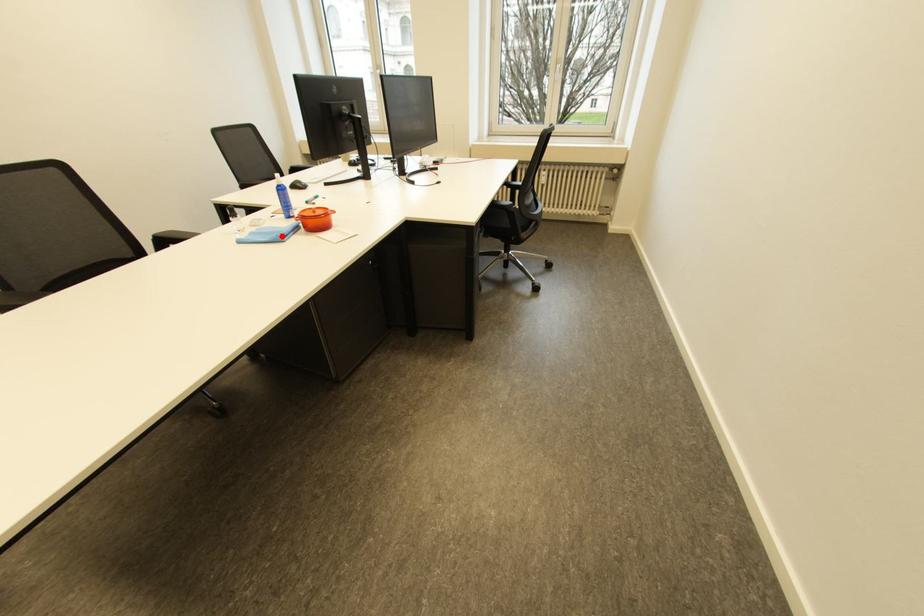
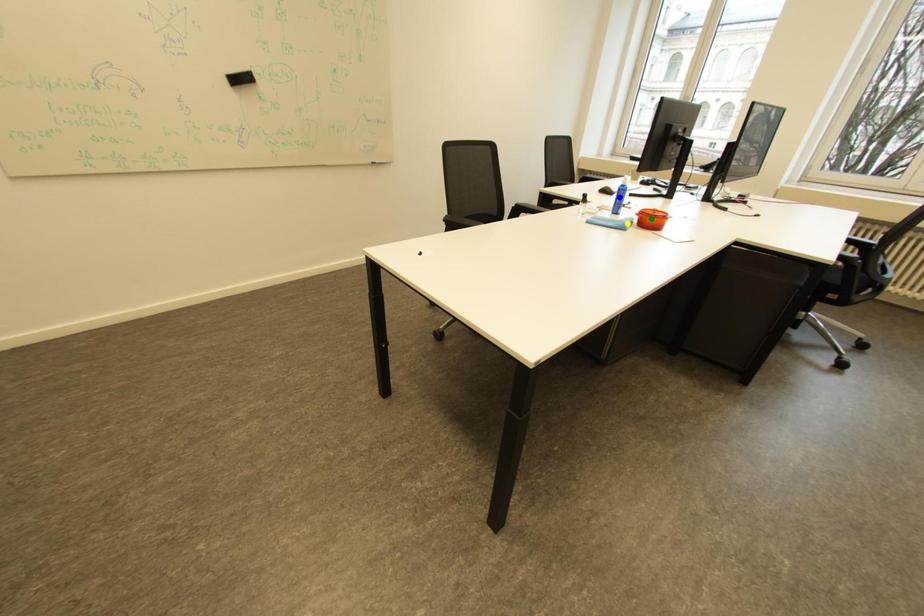
Question: I am providing you with two images of the same scene from different viewpoints. A red point is marked on the first image. You are given multiple points on the second image. Which point in image 2 represents the same 3d spot as the red point in image 1?

Choices:
 (A) yellow point
 (B) blue point
 (C) green point

Answer: (A)